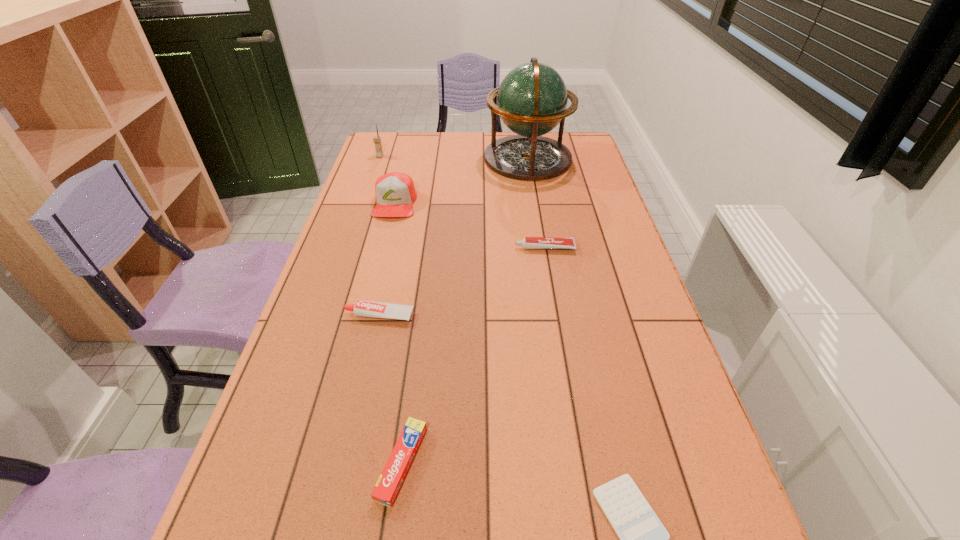
Where is `object that can be found as the sixth closest to the second tallest object`? Image resolution: width=960 pixels, height=540 pixels. object that can be found as the sixth closest to the second tallest object is located at coordinates (643, 538).

Identify the location of object that is the third closest to the nearest toothpaste. This screenshot has height=540, width=960. (528, 242).

This screenshot has height=540, width=960. In order to click on toothpaste identified as the closest to the farthest toothpaste in this screenshot , I will do `click(362, 308)`.

Identify which toothpaste is the second nearest to the nearest toothpaste. Please provide its 2D coordinates. Your answer should be formatted as a tuple, i.e. [(x, y)], where the tuple contains the x and y coordinates of a point satisfying the conditions above.

[(528, 242)]

This screenshot has height=540, width=960. I want to click on vacant point that satisfies the following two spatial constraints: 1. on the front of the second shortest object, where the keypad is located; 2. on the right side of the cellular telephone, so click(275, 463).

This screenshot has width=960, height=540. I want to click on blank space that satisfies the following two spatial constraints: 1. on the front-facing side of the tallest object; 2. on the front-facing side of the fifth shortest object, so click(535, 204).

Locate an element on the screen. vacant space that satisfies the following two spatial constraints: 1. on the front of the cellular telephone, where the keypad is located; 2. on the left side of the second shortest object is located at coordinates (275, 463).

This screenshot has width=960, height=540. What are the coordinates of `free space that satisfies the following two spatial constraints: 1. on the front-facing side of the third tallest object; 2. on the left side of the nearest toothpaste` in the screenshot? It's located at (329, 463).

What are the coordinates of `free space that satisfies the following two spatial constraints: 1. on the front-facing side of the shortest toothpaste; 2. on the left side of the fifth shortest object` in the screenshot? It's located at (329, 463).